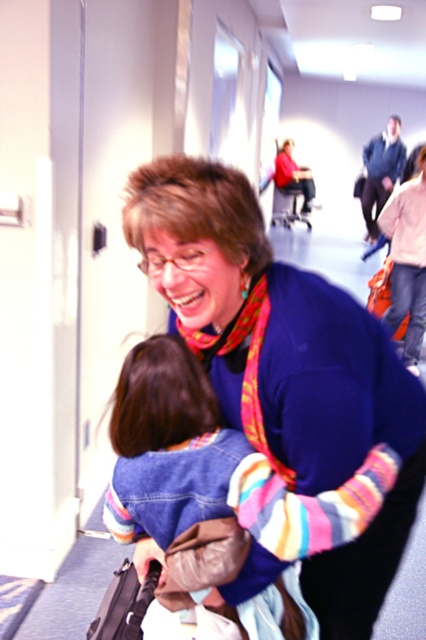
Who is positioned more to the left, blue sweater at center or denim jacket at lower right?

Positioned to the left is blue sweater at center.

Is blue sweater at center bigger than denim jacket at lower right?

Yes.

Which is in front, point (313, 422) or point (411, 360)?

Point (313, 422) is more forward.

This screenshot has width=426, height=640. I want to click on blue sweater at center, so click(284, 365).